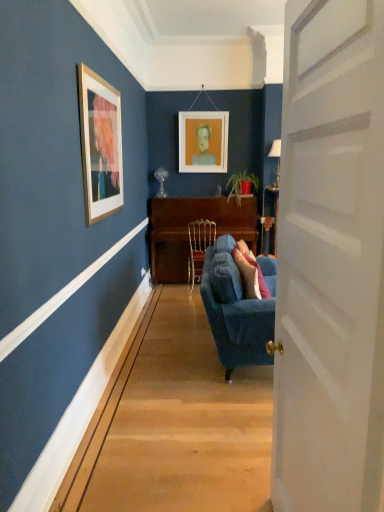
The image size is (384, 512). What do you see at coordinates (276, 159) in the screenshot?
I see `metallic silver lamp at right, the first lamp in the right-to-left sequence` at bounding box center [276, 159].

This screenshot has height=512, width=384. I want to click on gold metallic chair at center, so click(x=199, y=247).

Where is `white wooden door at right`? The image size is (384, 512). white wooden door at right is located at coordinates (331, 261).

Locate an element on the screen. wooden polished desk at center is located at coordinates (187, 230).

Identify the location of matte white picture frame at upper center. This screenshot has width=384, height=512. (203, 142).

Is metallic silver lamp at right, arranged as the 1th lamp when viewed from the front, with wooden polished desk at center?

metallic silver lamp at right, arranged as the 1th lamp when viewed from the front, is not next to wooden polished desk at center, and they're not touching.

From the image's perspective, which object appears higher, metallic silver lamp at right, arranged as the 1th lamp when viewed from the front, or wooden polished desk at center?

metallic silver lamp at right, arranged as the 1th lamp when viewed from the front, from the image's perspective.

How different are the orientations of metallic silver lamp at right, the second lamp when ordered from back to front, and wooden polished desk at center in degrees?

There is a 0.439-degree angle between the facing directions of metallic silver lamp at right, the second lamp when ordered from back to front, and wooden polished desk at center.

Where is `desk lying behind the metallic silver lamp at right, arranged as the second lamp when viewed from the left`? This screenshot has height=512, width=384. desk lying behind the metallic silver lamp at right, arranged as the second lamp when viewed from the left is located at coordinates [187, 230].

Is green matte plant at center spatially inside metallic silver lamp at right, arranged as the second lamp when viewed from the left, or outside of it?

green matte plant at center is outside metallic silver lamp at right, arranged as the second lamp when viewed from the left.

How much distance is there between green matte plant at center and metallic silver lamp at right, the second lamp when ordered from back to front?

The distance of green matte plant at center from metallic silver lamp at right, the second lamp when ordered from back to front, is 31.08 inches.

Considering the relative sizes of green matte plant at center and metallic silver lamp at right, arranged as the 1th lamp when viewed from the front, in the image provided, is green matte plant at center taller than metallic silver lamp at right, arranged as the 1th lamp when viewed from the front,?

No.

Considering the sizes of objects green matte plant at center and metallic silver lamp at right, the first lamp in the right-to-left sequence, in the image provided, who is smaller, green matte plant at center or metallic silver lamp at right, the first lamp in the right-to-left sequence,?

Smaller between the two is metallic silver lamp at right, the first lamp in the right-to-left sequence.

Is point (291, 207) positioned behind point (189, 262)?

No, it is in front of (189, 262).

Considering the positions of objects white wooden door at right and gold metallic chair at center in the image provided, who is in front, white wooden door at right or gold metallic chair at center?

Positioned in front is white wooden door at right.

Can you see white wooden door at right touching gold metallic chair at center?

No, white wooden door at right is not in contact with gold metallic chair at center.

Is white wooden door at right oriented away from gold metallic chair at center?

white wooden door at right does not have its back to gold metallic chair at center.

From a real-world perspective, is green matte plant at center physically located above or below gold metallic chair at center?

green matte plant at center is situated higher than gold metallic chair at center in the real world.

Is green matte plant at center taller than gold metallic chair at center?

In fact, green matte plant at center may be shorter than gold metallic chair at center.

Is green matte plant at center to the right of gold metallic chair at center from the viewer's perspective?

Yes, green matte plant at center is to the right of gold metallic chair at center.

What's the angular difference between green matte plant at center and gold metallic chair at center's facing directions?

There is a 175-degree angle between the facing directions of green matte plant at center and gold metallic chair at center.

Which of these two, green matte plant at center or white wooden door at right, is smaller?

Smaller between the two is green matte plant at center.

Does green matte plant at center have a lesser width compared to white wooden door at right?

In fact, green matte plant at center might be wider than white wooden door at right.

Is green matte plant at center surrounding white wooden door at right?

Definitely not — white wooden door at right is not inside green matte plant at center.

Is green matte plant at center directly adjacent to white wooden door at right?

No, green matte plant at center is not beside white wooden door at right.

Does green matte plant at center appear on the left side of velvet blue couch at center?

In fact, green matte plant at center is to the right of velvet blue couch at center.

Based on the photo, which object is wider, green matte plant at center or velvet blue couch at center?

velvet blue couch at center.

Is green matte plant at center in front of or behind velvet blue couch at center in the image?

Clearly, green matte plant at center is behind velvet blue couch at center.

From the picture: How much distance is there between green matte plant at center and velvet blue couch at center?

green matte plant at center is 3.18 meters from velvet blue couch at center.

Is matte glass lamp at upper center, which is the first lamp from back to front, looking in the opposite direction of green matte plant at center?

That's not correct — matte glass lamp at upper center, which is the first lamp from back to front, is not looking away from green matte plant at center.

Is point (156, 196) closer to viewer compared to point (230, 190)?

Yes.

From the image's perspective, is matte glass lamp at upper center, which is the first lamp from back to front, positioned above or below green matte plant at center?

Clearly, from the image's perspective, matte glass lamp at upper center, which is the first lamp from back to front, is above green matte plant at center.

I want to click on houseplant located in front of the matte glass lamp at upper center, which is the first lamp from back to front, so click(x=241, y=184).

Where is `desk behind the metallic silver lamp at right, arranged as the 1th lamp when viewed from the front`? desk behind the metallic silver lamp at right, arranged as the 1th lamp when viewed from the front is located at coordinates (187, 230).

Image resolution: width=384 pixels, height=512 pixels. In order to click on lamp lying on the right of green matte plant at center in this screenshot , I will do `click(276, 159)`.

From the picture: Based on their spatial positions, is gold metallic chair at center or white wooden door at right further from green matte plant at center?

white wooden door at right lies further to green matte plant at center than the other object.

Considering their positions, is matte glass lamp at upper center, the 1th lamp from the left, positioned further to white wooden door at right than metallic silver lamp at right, the second lamp when ordered from back to front?

Based on the image, matte glass lamp at upper center, the 1th lamp from the left, appears to be further to white wooden door at right.

When comparing their distances from velvet blue couch at center, does white wooden door at right or matte glass lamp at upper center, positioned as the second lamp in right-to-left order, seem closer?

Among the two, white wooden door at right is located nearer to velvet blue couch at center.

From the image, which object appears to be farther from matte glass lamp at upper center, the 1th lamp from the left, wooden polished desk at center or matte white picture frame at upper center?

wooden polished desk at center is positioned further to the anchor matte glass lamp at upper center, the 1th lamp from the left.

From the image, which object appears to be farther from white wooden door at right, green matte plant at center or metallic silver lamp at right, the second lamp when ordered from back to front?

green matte plant at center is positioned further to the anchor white wooden door at right.

Considering their positions, is matte glass lamp at upper center, positioned as the second lamp in right-to-left order, positioned closer to white wooden door at right than matte white picture frame at upper center?

matte glass lamp at upper center, positioned as the second lamp in right-to-left order, is positioned closer to the anchor white wooden door at right.

When comparing their distances from green matte plant at center, does velvet blue couch at center or matte white picture frame at upper center seem further?

velvet blue couch at center lies further to green matte plant at center than the other object.

When comparing their distances from metallic silver lamp at right, arranged as the second lamp when viewed from the left, does wooden polished desk at center or matte white picture frame at upper center seem further?

wooden polished desk at center is positioned further to the anchor metallic silver lamp at right, arranged as the second lamp when viewed from the left.

Locate an element on the screen. The image size is (384, 512). desk between velvet blue couch at center and matte glass lamp at upper center, which is the first lamp from back to front, along the z-axis is located at coordinates (187, 230).

The height and width of the screenshot is (512, 384). What are the coordinates of `chair between matte glass lamp at upper center, the 2th lamp in the front-to-back sequence, and metallic silver lamp at right, the second lamp when ordered from back to front, from left to right` in the screenshot? It's located at (199, 247).

Where is `chair between velvet blue couch at center and green matte plant at center in the front-back direction`? This screenshot has height=512, width=384. chair between velvet blue couch at center and green matte plant at center in the front-back direction is located at coordinates (199, 247).

The height and width of the screenshot is (512, 384). Find the location of `desk between white wooden door at right and green matte plant at center in the front-back direction`. desk between white wooden door at right and green matte plant at center in the front-back direction is located at coordinates (187, 230).